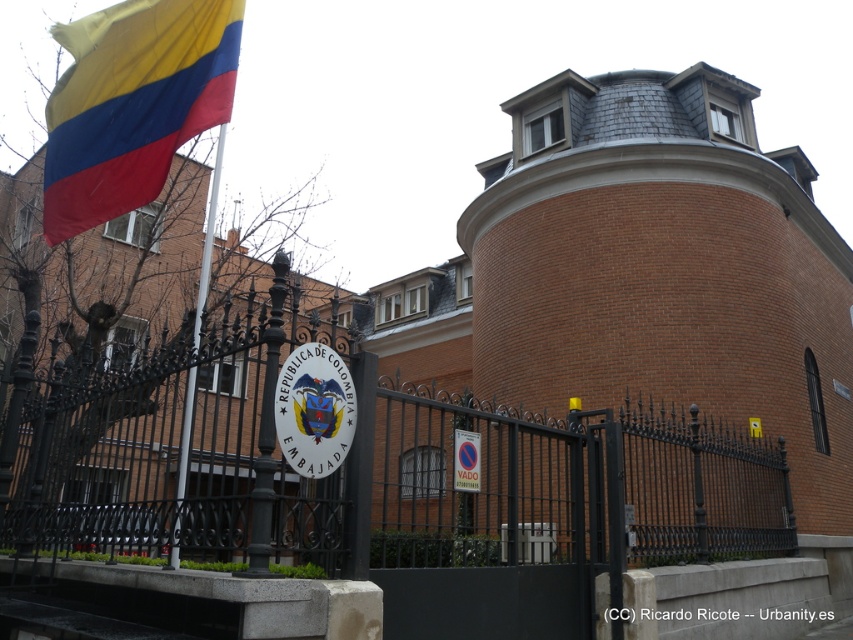
You are a visitor approaching the Colombian Embassy and notice the matte fabric flag at upper left and the polished metal flag pole at left. Which object takes up more space in the scene?

The polished metal flag pole at left takes up more space in the scene than the matte fabric flag at upper left.

You are standing in front of the Colombian Embassy and want to take a photo of both the black wrought iron fence at center and the matte fabric flag at upper left. Which object should you focus on first to ensure both are in clear view?

You should focus on the black wrought iron fence at center first because it is closer to the viewer than the matte fabric flag at upper left, so adjusting focus starting from the closer object will help both be in clear view.

In the scene shown: You are standing at the Colombian Embassy and need to locate two specific points marked on a map. The first point is at coordinates point (578, 500) and the second is at point (140, 61). According to the scene description, which point is closer to the viewer?

Point (140, 61) is closer to the viewer because the description states that point (578, 500) is behind it.